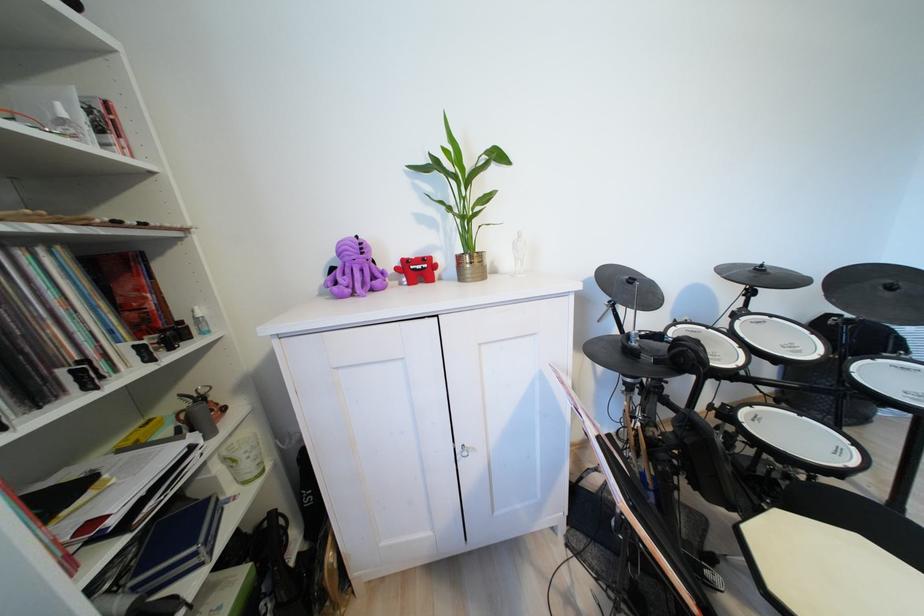
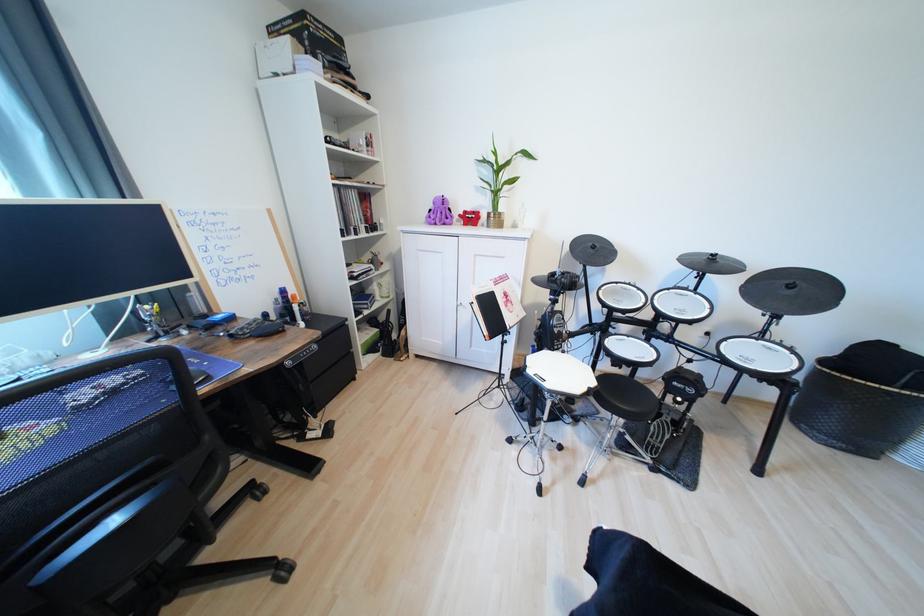
Locate, in the second image, the point that corresponds to the point at 360,274 in the first image.

(447, 216)